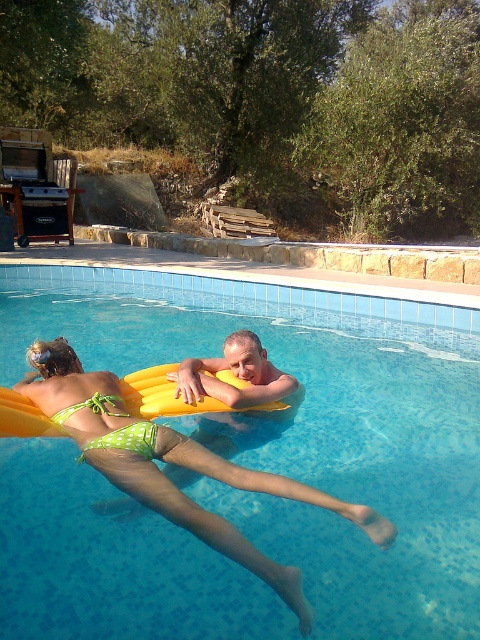
Question: Observing the image, what is the correct spatial positioning of transparent plastic pool at center in reference to smooth yellow float at center?

Choices:
 (A) above
 (B) below

Answer: (B)

Question: Does transparent plastic pool at center appear under smooth yellow float at center?

Choices:
 (A) yes
 (B) no

Answer: (A)

Question: Which of the following is the closest to the observer?

Choices:
 (A) (83, 307)
 (B) (260, 344)

Answer: (B)

Question: Which of the following is the closest to the observer?

Choices:
 (A) (115, 339)
 (B) (260, 374)

Answer: (B)

Question: Observing the image, what is the correct spatial positioning of transparent plastic pool at center in reference to smooth yellow float at center?

Choices:
 (A) left
 (B) right

Answer: (B)

Question: Which of the following is the closest to the observer?

Choices:
 (A) (259, 417)
 (B) (268, 548)

Answer: (B)